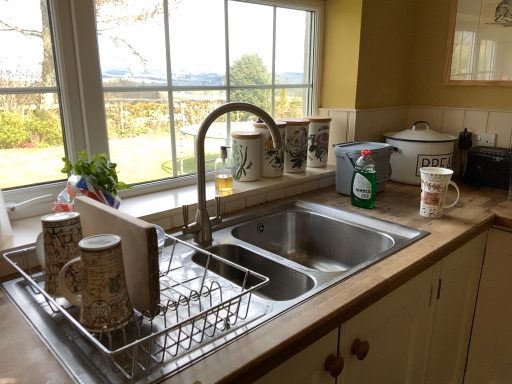
This screenshot has height=384, width=512. In order to click on vacant area that is in front of white ceramic mug at right, marked as the second mug in a bottom-to-top arrangement in this screenshot , I will do pos(440,225).